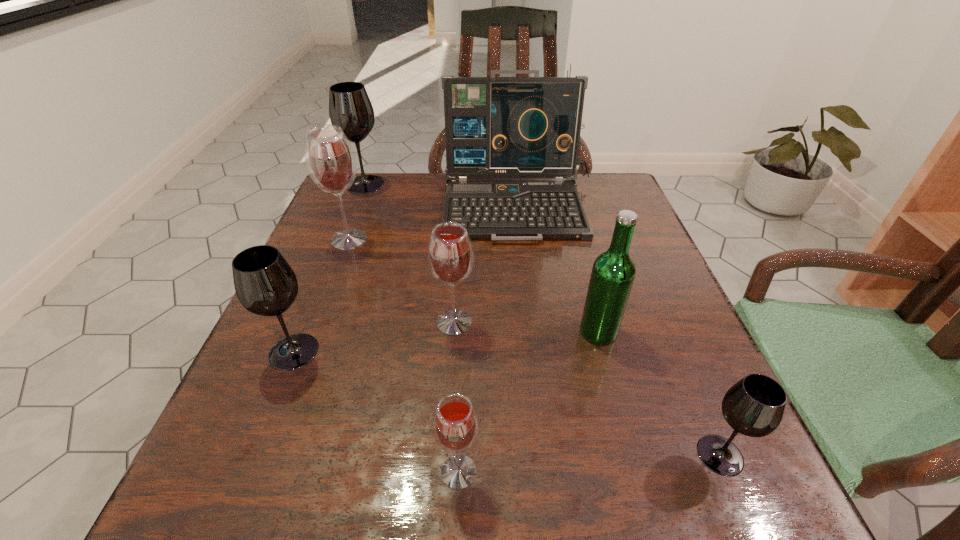
Identify the location of unoccupied position between the second farthest red wineglass and the rightmost wineglass. (588, 389).

Identify the location of free space between the second nearest red wineglass and the second farthest gray wineglass. tap(374, 337).

The image size is (960, 540). I want to click on vacant space that is in between the biggest gray wineglass and the second nearest red wineglass, so click(x=410, y=253).

Select which object is the seventh closest to the nearest gray wineglass. Please provide its 2D coordinates. Your answer should be formatted as a tuple, i.e. [(x, y)], where the tuple contains the x and y coordinates of a point satisfying the conditions above.

[(350, 108)]

This screenshot has width=960, height=540. Identify the location of object that is the fifth closest one to the farthest gray wineglass. coord(613,272).

In order to click on wineglass that is the second closest to the rightmost wineglass in this screenshot , I will do `click(450, 253)`.

Identify which wineglass is the closest to the farthest gray wineglass. Please provide its 2D coordinates. Your answer should be formatted as a tuple, i.e. [(x, y)], where the tuple contains the x and y coordinates of a point satisfying the conditions above.

[(330, 159)]

Where is `gray wineglass that is the second closest to the second nearest gray wineglass`? The height and width of the screenshot is (540, 960). gray wineglass that is the second closest to the second nearest gray wineglass is located at coordinates (754, 406).

Image resolution: width=960 pixels, height=540 pixels. What are the coordinates of `gray wineglass identified as the closest to the farthest wineglass` in the screenshot? It's located at (265, 284).

Locate an element on the screen. This screenshot has height=540, width=960. red wineglass object that ranks as the third closest to the second farthest gray wineglass is located at coordinates (455, 424).